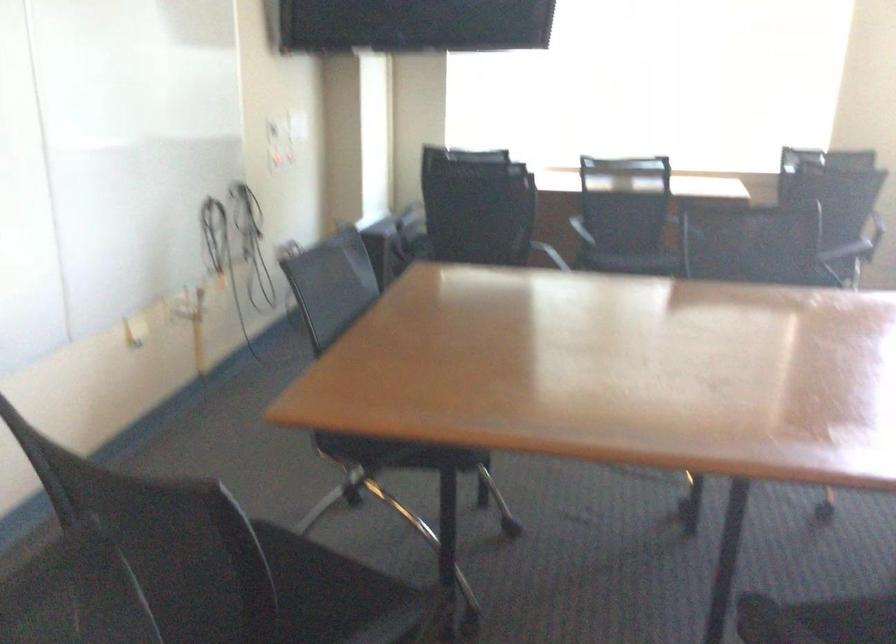
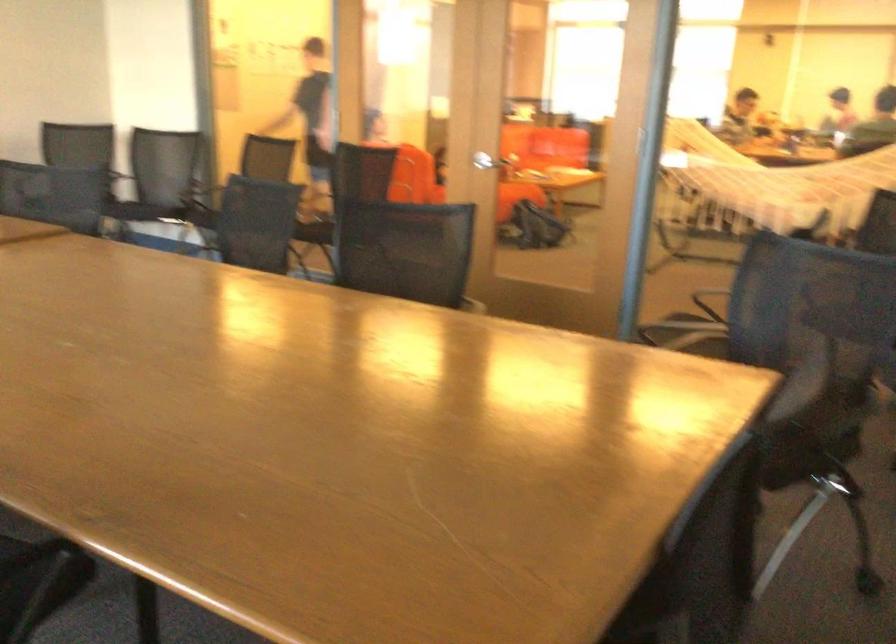
Question: I am providing you with two images of the same scene from different viewpoints. Please identify which objects are invisible in image2.

Choices:
 (A) chair sitting surface
 (B) sofa sitting surface
 (C) silver door handle
 (D) dispenser turn knob

Answer: (A)